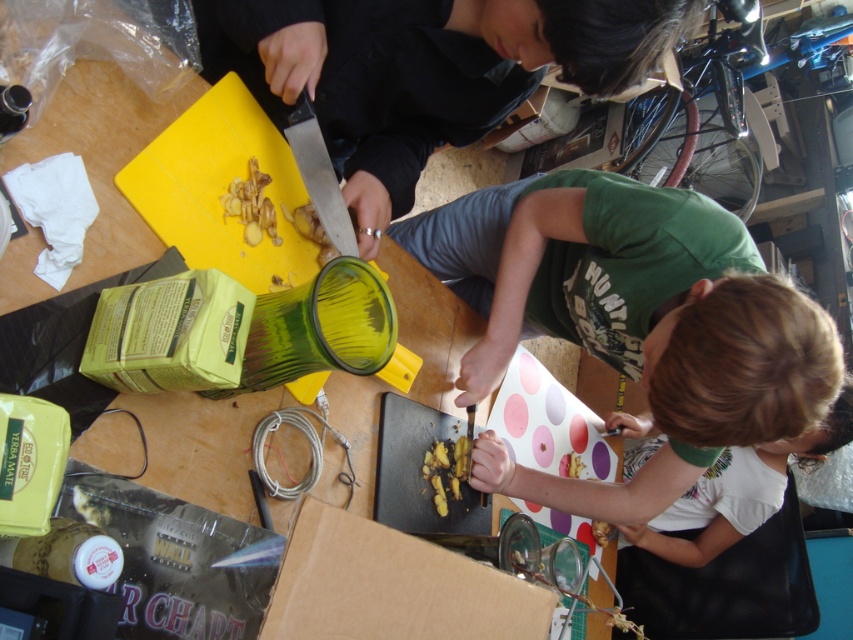
You are looking at the scene where two people are preparing food at a wooden table. You see a person with a green T shirt cutting ginger on a black cutting board and another person in dark clothing cutting on a yellow cutting board. Where is the yellow translucent food at lower center located in relation to the two people?

The yellow translucent food at lower center is located at point (447, 470), which places it near the lower central area of the scene, between the two individuals preparing food.